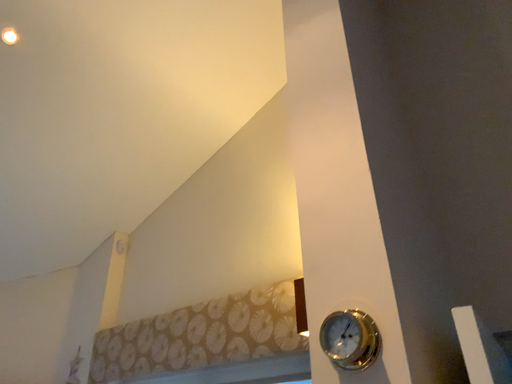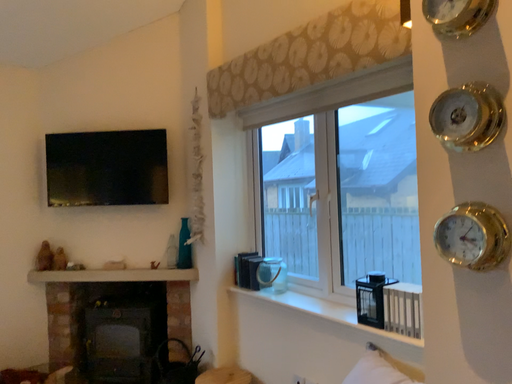
Question: How did the camera likely rotate when shooting the video?

Choices:
 (A) rotated downward
 (B) rotated upward

Answer: (A)